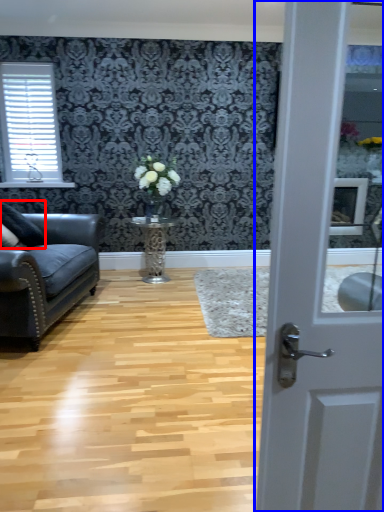
Question: Which object appears closest to the camera in this image, pillow (highlighted by a red box) or door (highlighted by a blue box)?

Choices:
 (A) pillow
 (B) door

Answer: (B)